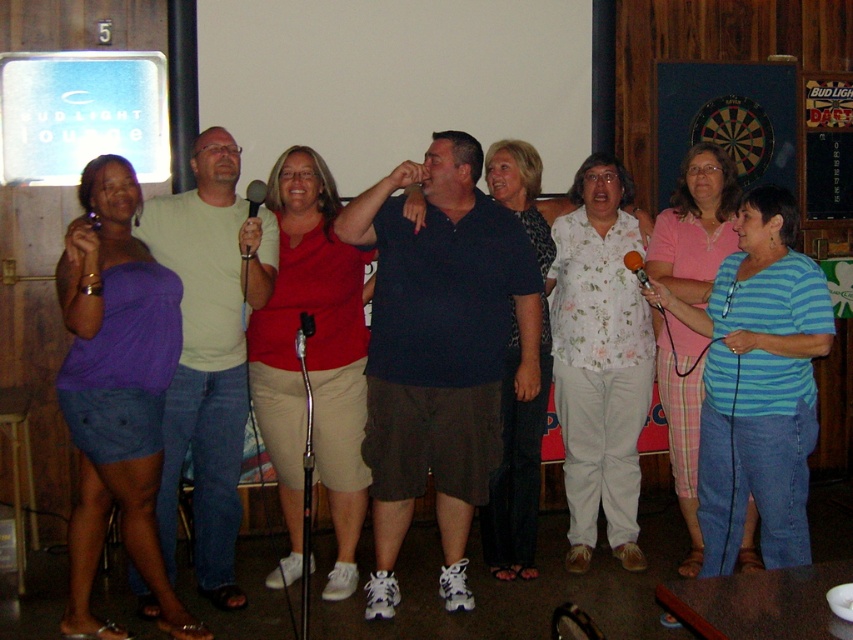
Question: Which is nearer to the matte black microphone at center?

Choices:
 (A) purple satin dress at left
 (B) black plastic microphone at center
 (C) floral cotton blouse at center

Answer: (B)

Question: Can you confirm if floral cotton blouse at center is positioned below matte black microphone at center?

Choices:
 (A) yes
 (B) no

Answer: (A)

Question: Observing the image, what is the correct spatial positioning of floral print blouse at center in reference to matte black microphone at center?

Choices:
 (A) above
 (B) below

Answer: (B)

Question: Among these objects, which one is farthest from the camera?

Choices:
 (A) floral print blouse at center
 (B) translucent plastic microphone at center
 (C) light green t-shirt at center

Answer: (A)

Question: Considering the relative positions of dark blue cotton polo shirt at center and light green t-shirt at center in the image provided, where is dark blue cotton polo shirt at center located with respect to light green t-shirt at center?

Choices:
 (A) above
 (B) below

Answer: (B)

Question: Which object is closer to the camera taking this photo?

Choices:
 (A) blue striped shirt at center
 (B) purple satin dress at left
 (C) floral print blouse at center

Answer: (B)